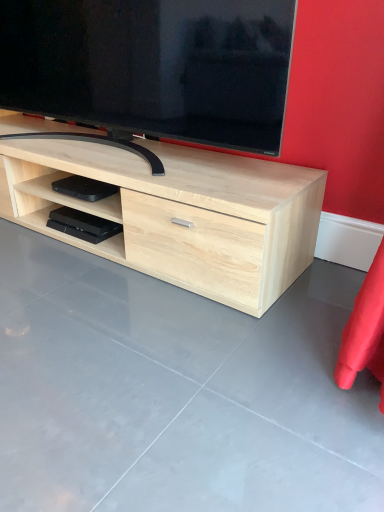
Describe the element at coordinates (153, 66) in the screenshot. I see `matte black tv at center` at that location.

Measure the distance between matte black tv at center and camera.

matte black tv at center and camera are 1.03 meters apart.

Locate an element on the screen. The image size is (384, 512). matte black tv at center is located at coordinates pos(153,66).

Image resolution: width=384 pixels, height=512 pixels. In order to click on matte black tv at center in this screenshot , I will do tap(153, 66).